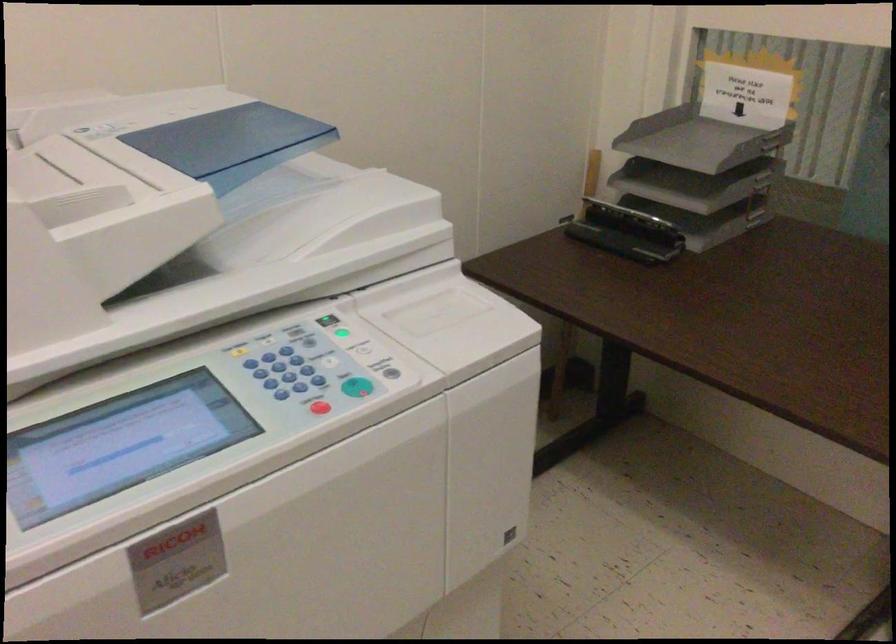
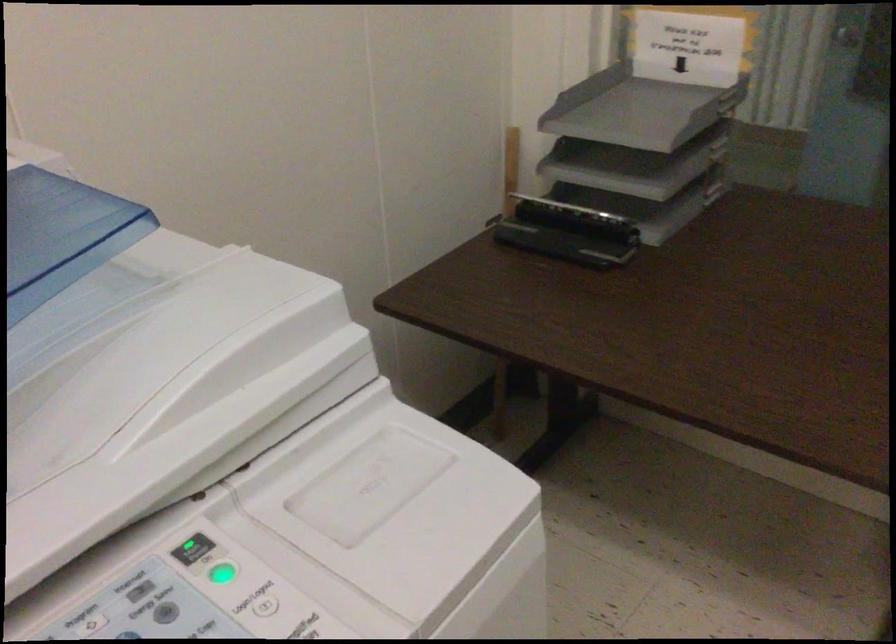
Question: The camera is either moving clockwise (left) or counter-clockwise (right) around the object. The first image is from the beginning of the video and the second image is from the end. Is the camera moving left or right when shooting the video?

Choices:
 (A) Left
 (B) Right

Answer: (A)